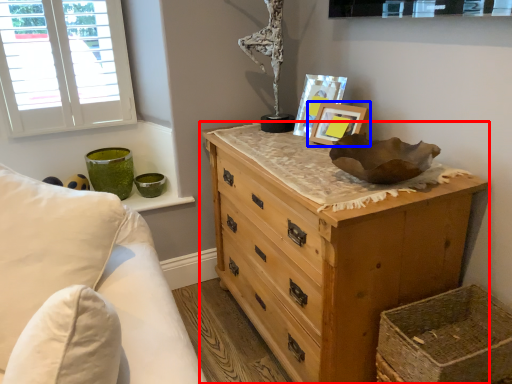
Question: Among these objects, which one is farthest to the camera, chest of drawers (highlighted by a red box) or picture frame (highlighted by a blue box)?

Choices:
 (A) chest of drawers
 (B) picture frame

Answer: (B)